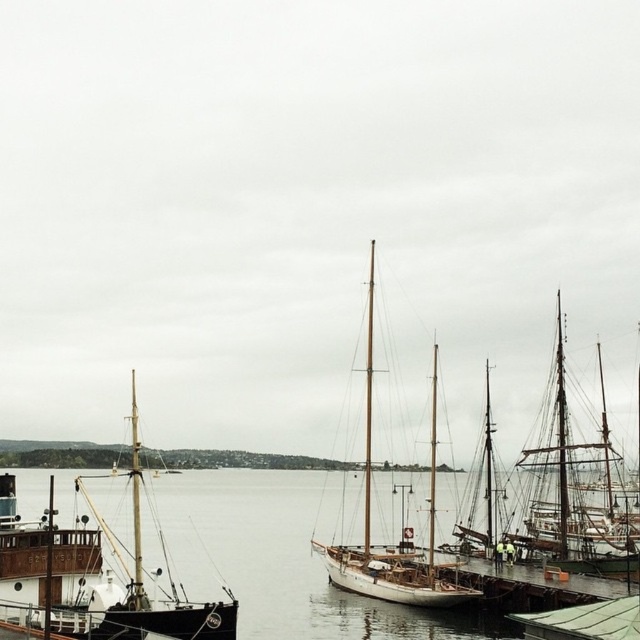
You are a sailor trying to navigate between the clear water at center and the dark brown wooden ship at left. Which direction should you steer your boat to move from the ship towards the water?

The clear water at center is to the right of the dark brown wooden ship at left, so you should steer your boat to the right to move from the ship towards the water.

You are standing on the wooden pier and want to board the dark brown wooden ship at left. Which direction should you walk relative to the white wooden sailboat at center?

You should walk towards the left direction relative to the white wooden sailboat at center because the dark brown wooden ship at left is positioned below it, meaning it is located to the left side of the harbor.